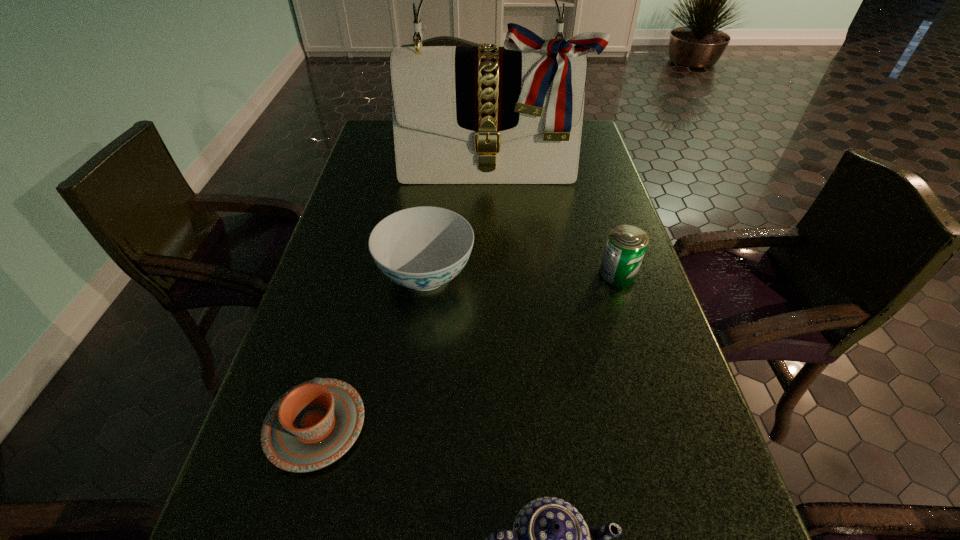
Find the location of a particular element. This screenshot has height=540, width=960. free space at the far right corner of the desktop is located at coordinates (590, 128).

Locate an element on the screen. Image resolution: width=960 pixels, height=540 pixels. vacant area that lies between the farthest chinaware and the shortest object is located at coordinates (371, 350).

Where is `vacant region between the farthest object and the shortest chinaware`? This screenshot has width=960, height=540. vacant region between the farthest object and the shortest chinaware is located at coordinates (404, 298).

Identify the location of unoccupied position between the satchel and the shortest chinaware. (404, 298).

The image size is (960, 540). I want to click on vacant point located between the can and the second nearest chinaware, so click(x=467, y=350).

At what (x,y) coordinates should I click in order to perform the action: click on object that is the fourth closest to the farthest chinaware. Please return your answer as a coordinate pair (x, y). Looking at the image, I should click on (533, 539).

You are a GUI agent. You are given a task and a screenshot of the screen. Output one action in this format:
    pyautogui.click(x=<x>, y=<y>)
    Task: Click on the closest object relative to the farthest chinaware
    This screenshot has height=540, width=960.
    Given the screenshot: What is the action you would take?
    pyautogui.click(x=312, y=425)

Identify the location of chinaware object that ranks as the second closest to the shortest object. (533, 539).

Identify the location of chinaware that is the nearest to the farthest chinaware. This screenshot has height=540, width=960. [x=312, y=425].

Find the location of `vacant position in the image that satisfies the following two spatial constraints: 1. on the front-facing side of the tallest object; 2. on the left side of the can`. vacant position in the image that satisfies the following two spatial constraints: 1. on the front-facing side of the tallest object; 2. on the left side of the can is located at coordinates (496, 274).